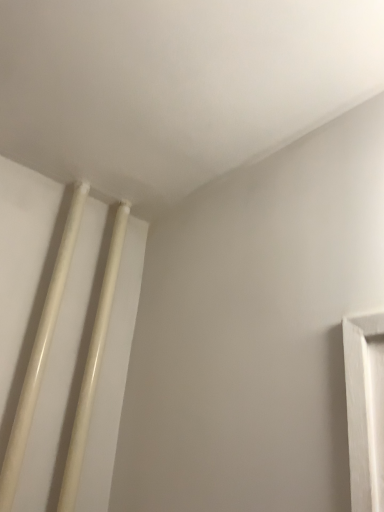
Where is `white glossy pipe at upper left`? The height and width of the screenshot is (512, 384). white glossy pipe at upper left is located at coordinates (93, 365).

The width and height of the screenshot is (384, 512). What do you see at coordinates (93, 365) in the screenshot?
I see `white glossy pipe at upper left` at bounding box center [93, 365].

Identify the location of white glossy pipe at upper left. The image size is (384, 512). (93, 365).